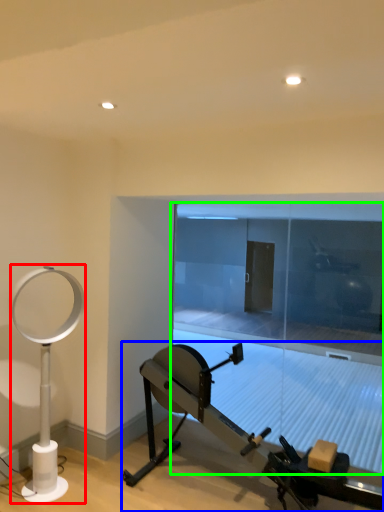
Question: Which is farther away from table lamp (highlighted by a red box)? stationary bicycle (highlighted by a blue box) or glass door (highlighted by a green box)?

Choices:
 (A) stationary bicycle
 (B) glass door

Answer: (B)